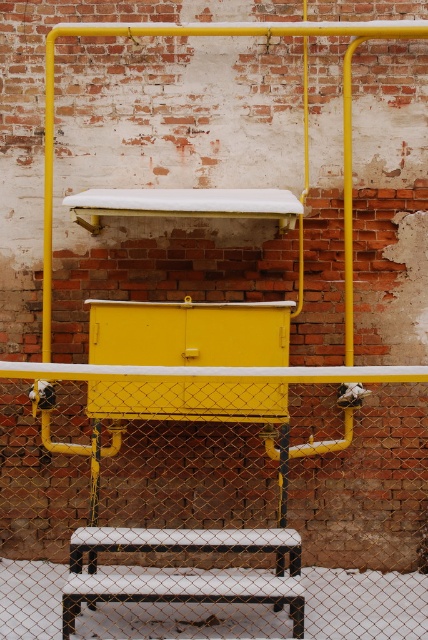
Is metal chain-link fence at center positioned before white plastic stool at lower center?

No, it is behind white plastic stool at lower center.

Is point (184, 480) positioned in front of point (139, 580)?

No, (184, 480) is behind (139, 580).

The height and width of the screenshot is (640, 428). I want to click on metal chain-link fence at center, so click(x=214, y=518).

Locate an element on the screen. Image resolution: width=428 pixels, height=640 pixels. metal chain-link fence at center is located at coordinates (214, 518).